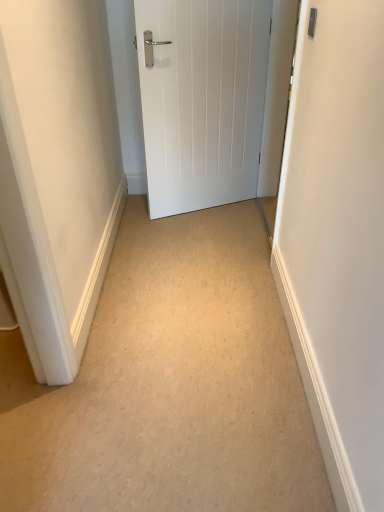
Where is `free space on the front side of white matte door at center`? free space on the front side of white matte door at center is located at coordinates (207, 237).